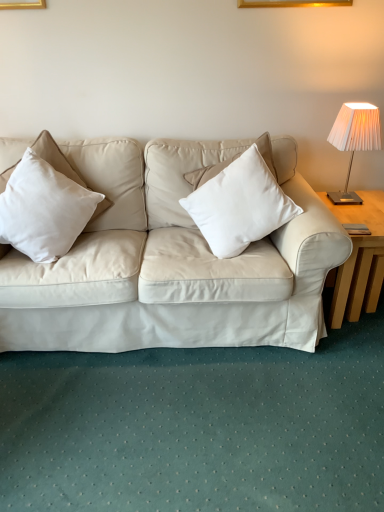
Identify the location of vacant area that is in front of white pleated fabric lampshade at upper right. The image size is (384, 512). (357, 215).